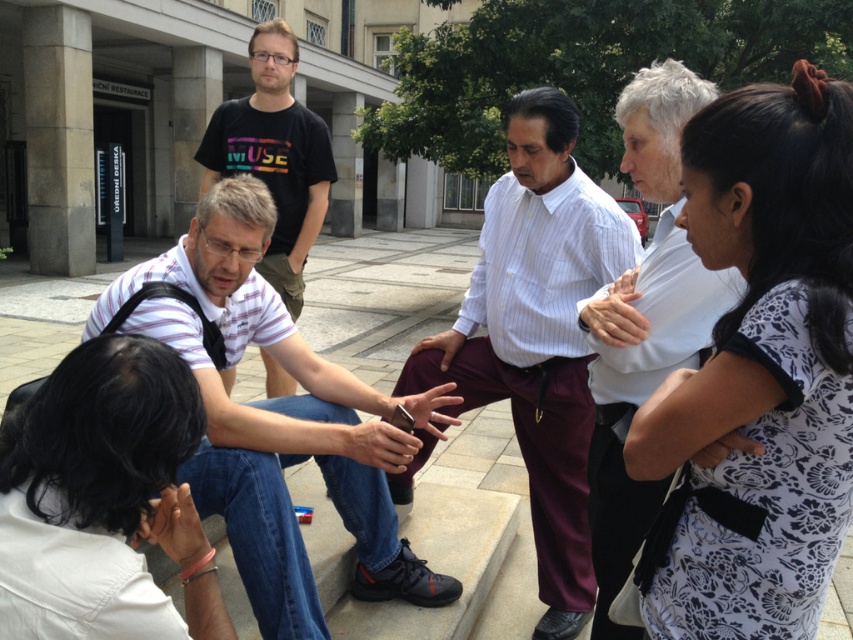
You are a photographer standing at the edge of the plaza. You want to capture a photo of the white fabric at lower left and the brown leather hand at center without any obstruction. Based on their positions, which object should you focus on first to ensure both are in frame?

The white fabric at lower left is located below the brown leather hand at center. To capture both without obstruction, focus on the brown leather hand at center first, as it is positioned higher and can be framed above the white fabric at lower left.

You are a photographer trying to capture a candid shot of the white floral dress at upper right and the brown leather hand at center. Which object should you focus on first to ensure both are in frame?

The white floral dress at upper right is in front of the brown leather hand at center, so you should focus on the brown leather hand at center first to ensure both are in frame.

You are standing at the point marked as point (190,573) in the image. You want to walk to the nearest exit, which is located 2 meters away from your current position. Can you reach the exit without moving more than 2 meters?

The distance between point (190,573) and the viewer is 1.58 meters. Since the exit is 2 meters away from your current position, you can reach the exit without moving more than 2 meters because 1.58 meters is less than 2 meters.